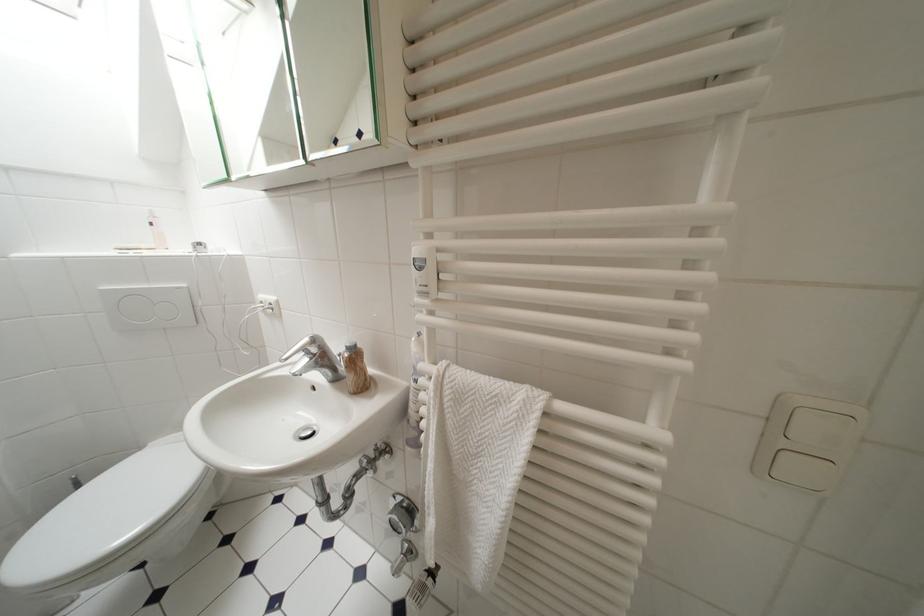
What do you see at coordinates (808, 440) in the screenshot? I see `the light switch button` at bounding box center [808, 440].